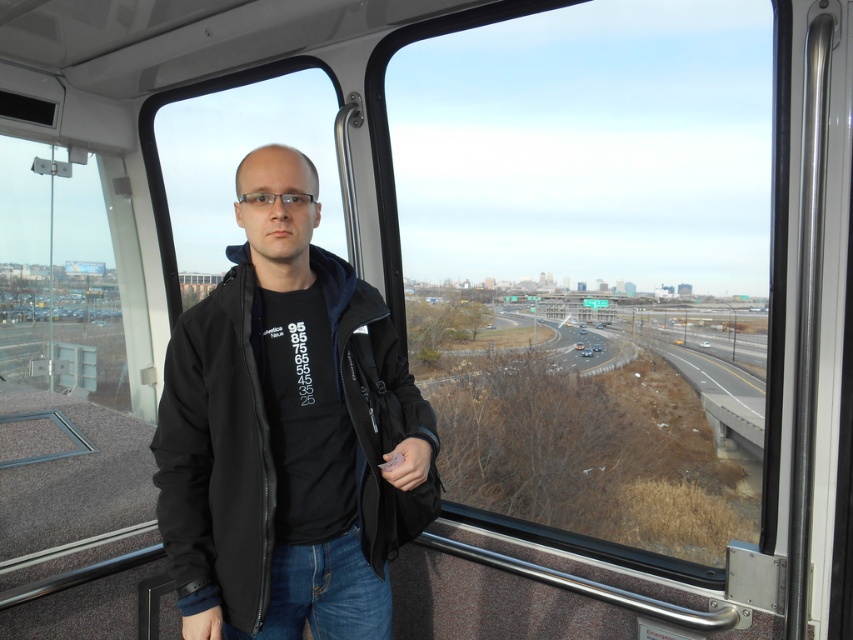
You are a passenger on a train and want to see the outside view clearly through the transparent glass window at center. However, you notice the black softshell jacket at center might block your view. Based on their heights, can you determine if the window is taller than the jacket?

The transparent glass window at center has a greater height compared to the black softshell jacket at center, so the window is taller than the jacket, meaning the jacket won t fully block your view.

You are inside the train car and want to look outside through the transparent glass window at center. Where should you look to see it?

The transparent glass window at center is located at point (x=596, y=260), so you should look towards that coordinate to see it.